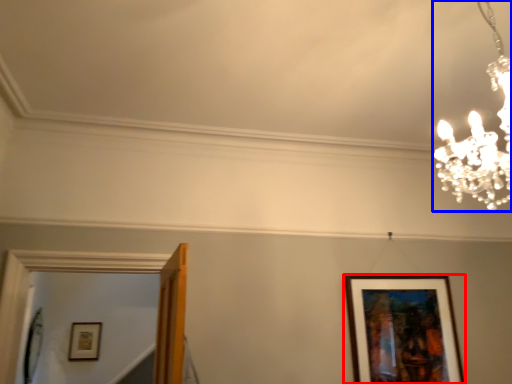
Question: Which of the following is the farthest to the observer, picture frame (highlighted by a red box) or lamp (highlighted by a blue box)?

Choices:
 (A) picture frame
 (B) lamp

Answer: (A)